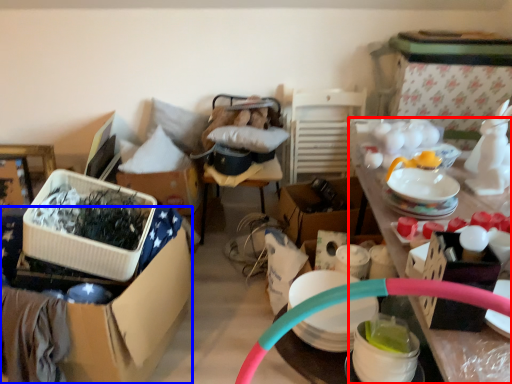
Question: Which object is further to the camera taking this photo, desk (highlighted by a red box) or box (highlighted by a blue box)?

Choices:
 (A) desk
 (B) box

Answer: (B)